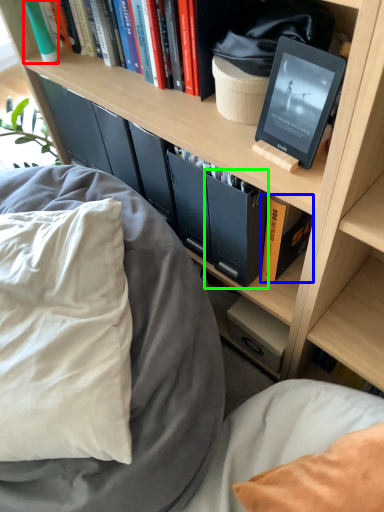
Question: Which object is the closest to the book (highlighted by a red box)? Choose among these: book (highlighted by a blue box) or paperback book (highlighted by a green box).

Choices:
 (A) book
 (B) paperback book

Answer: (B)